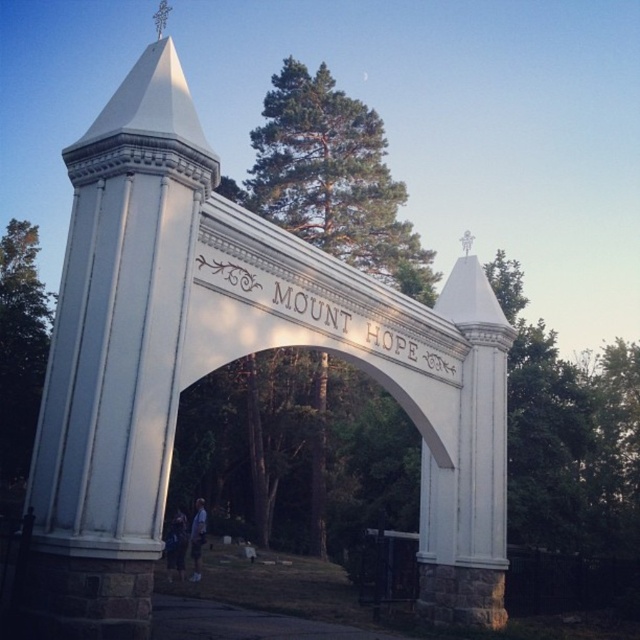
You are standing at the base of the grand white archway with the inscription MOUNT HOPE. You notice a green leafy tree at left and dark blue jeans at lower center. Which object is bigger in the image?

The green leafy tree at left is larger in size compared to the dark blue jeans at lower center.

You are standing in front of the grand white archway with the inscription and want to take a photo that includes both the archway and the green leafy tree at center. Based on their positions, will the tree be visible in the frame if you position yourself directly in front of the archway?

The green leafy tree at center is located at point coordinates that are not provided in the scene description, so without specific spatial relations, it is unclear if it would be in frame. However, since the tree is described as being at the center, positioning yourself directly in front of the archway should keep the tree within the frame.

You are standing at the base of the grand white archway with the inscription. You notice a point marked at coordinates point (20, 346). Based on the scene, can you determine what this point is located on?

The point (20, 346) is located on the green leafy tree at left.